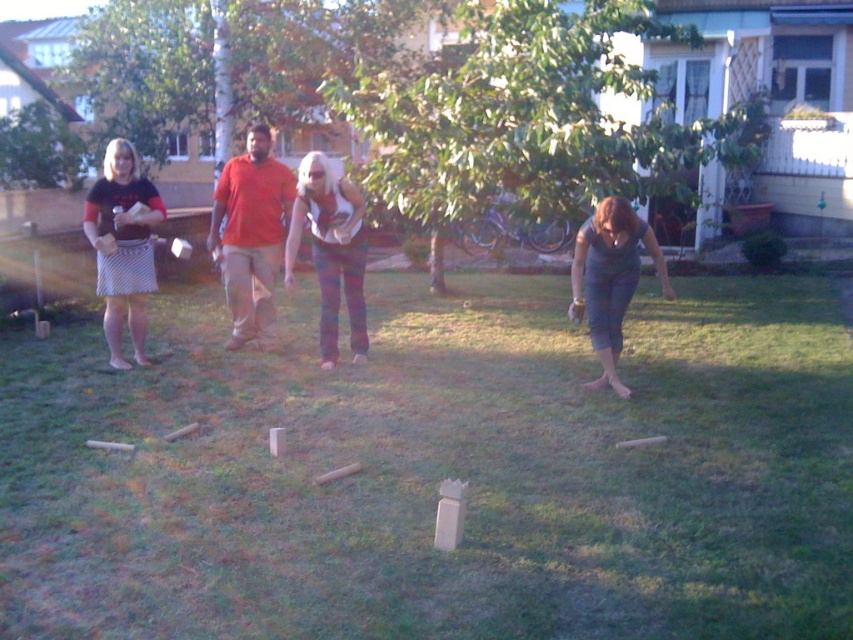
Question: Is green grass at center below green leafy tree at center?

Choices:
 (A) yes
 (B) no

Answer: (A)

Question: Is green grass at center behind striped cotton skirt at left?

Choices:
 (A) no
 (B) yes

Answer: (A)

Question: Which object appears farthest from the camera in this image?

Choices:
 (A) matte orange shirt at center
 (B) matte gray tank top at lower right
 (C) striped cotton skirt at left
 (D) green leafy tree at center

Answer: (D)

Question: Which point appears closest to the camera in this image?

Choices:
 (A) (548, 8)
 (B) (622, 228)
 (C) (138, 192)

Answer: (B)

Question: Considering the relative positions of matte orange shirt at center and matte gray tank top at lower right in the image provided, where is matte orange shirt at center located with respect to matte gray tank top at lower right?

Choices:
 (A) left
 (B) right

Answer: (A)

Question: Which of the following is the closest to the observer?

Choices:
 (A) matte gray tank top at lower right
 (B) striped cotton skirt at left
 (C) green leafy tree at center

Answer: (A)